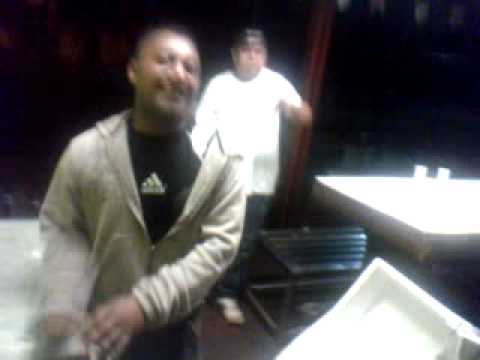
You are a GUI agent. You are given a task and a screenshot of the screen. Output one action in this format:
    pyautogui.click(x=<x>, y=<y>)
    Task: Click on the pillar
    The height and width of the screenshot is (360, 480).
    Given the screenshot: What is the action you would take?
    pyautogui.click(x=308, y=65)